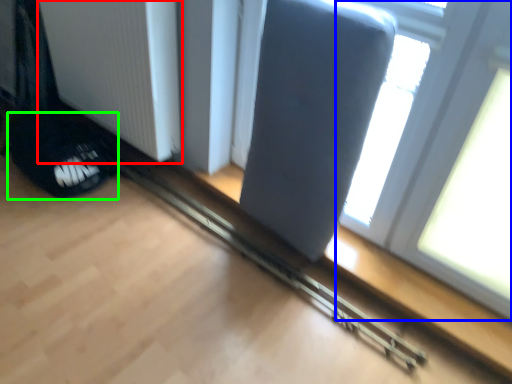
Question: Which is nearer to the radiator (highlighted by a red box)? window (highlighted by a blue box) or footwear (highlighted by a green box).

Choices:
 (A) window
 (B) footwear

Answer: (B)